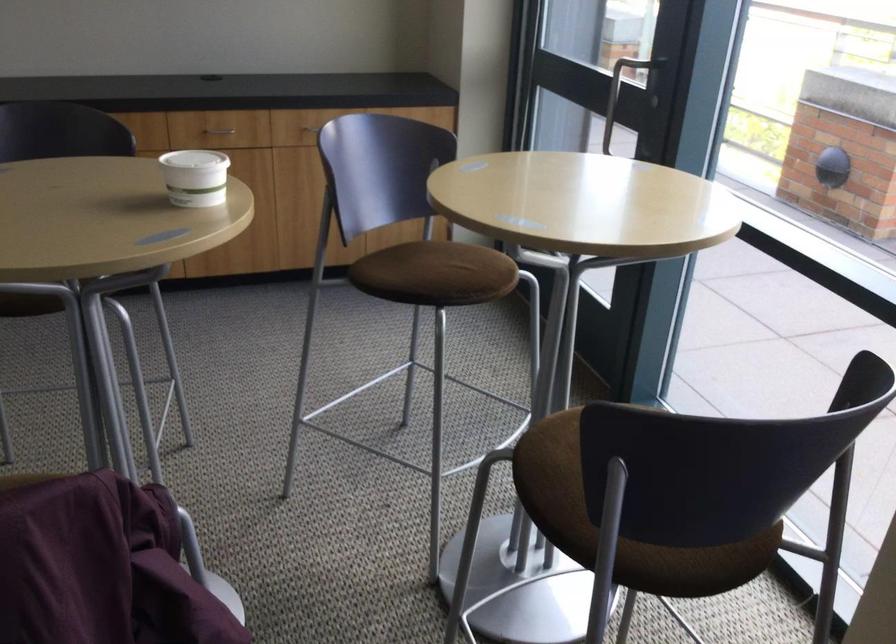
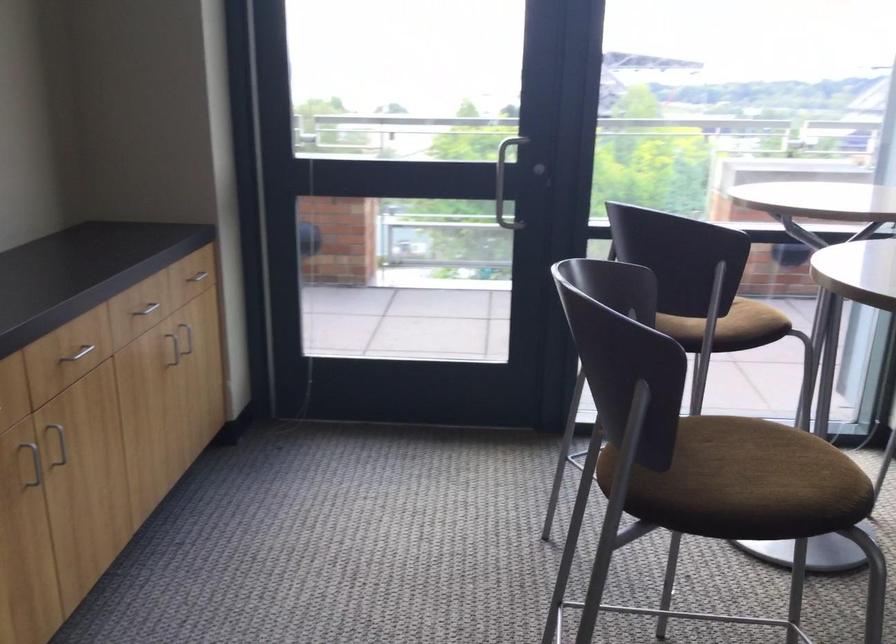
The point at (426,292) is marked in the first image. Where is the corresponding point in the second image?

(748, 319)